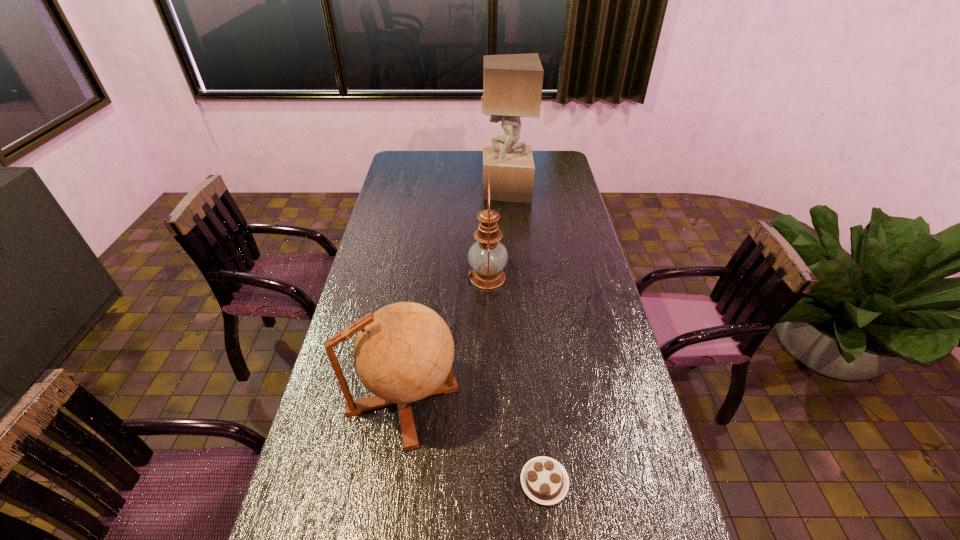
Locate an element on the screen. The image size is (960, 540). vacant area that lies between the globe and the tallest object is located at coordinates (454, 294).

Where is `free spot between the nearest object and the globe`? free spot between the nearest object and the globe is located at coordinates (473, 440).

Locate an element on the screen. The image size is (960, 540). free area in between the tallest object and the leftmost object is located at coordinates (454, 294).

Where is `blank region between the shortest object and the oil lamp`? blank region between the shortest object and the oil lamp is located at coordinates (516, 380).

Locate an element on the screen. The height and width of the screenshot is (540, 960). vacant area that lies between the chocolate cake and the third nearest object is located at coordinates (516, 380).

Point out which object is positioned as the third nearest to the leftmost object. Please provide its 2D coordinates. Your answer should be formatted as a tuple, i.e. [(x, y)], where the tuple contains the x and y coordinates of a point satisfying the conditions above.

[(512, 83)]

The width and height of the screenshot is (960, 540). In order to click on the second closest object relative to the oil lamp in this screenshot , I will do `click(512, 83)`.

Identify the location of vacant point that satisfies the following two spatial constraints: 1. on the surface of the third farthest object; 2. on the right side of the chocolate cake. pyautogui.click(x=391, y=482).

The height and width of the screenshot is (540, 960). Find the location of `vacant area in the image that satisfies the following two spatial constraints: 1. on the front-facing side of the chocolate cake; 2. on the right side of the tallest object`. vacant area in the image that satisfies the following two spatial constraints: 1. on the front-facing side of the chocolate cake; 2. on the right side of the tallest object is located at coordinates (529, 482).

The height and width of the screenshot is (540, 960). Identify the location of vacant space that satisfies the following two spatial constraints: 1. on the surface of the nearest object; 2. on the left side of the globe. (391, 482).